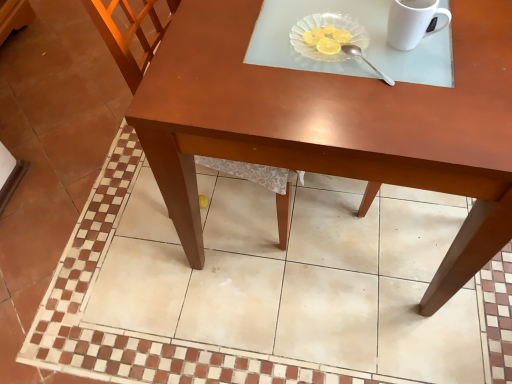
Question: Is the depth of white glossy mug at upper right greater than that of transparent glass plate at upper center?

Choices:
 (A) yes
 (B) no

Answer: (B)

Question: Is transparent glass plate at upper center located within white glossy mug at upper right?

Choices:
 (A) no
 (B) yes

Answer: (A)

Question: Does white glossy mug at upper right have a lesser height compared to transparent glass plate at upper center?

Choices:
 (A) no
 (B) yes

Answer: (A)

Question: Does white glossy mug at upper right come in front of transparent glass plate at upper center?

Choices:
 (A) no
 (B) yes

Answer: (B)

Question: Is white glossy mug at upper right thinner than transparent glass plate at upper center?

Choices:
 (A) no
 (B) yes

Answer: (B)

Question: Can you confirm if white glossy mug at upper right is wider than transparent glass plate at upper center?

Choices:
 (A) no
 (B) yes

Answer: (A)

Question: Is wooden chair at center oriented away from transparent glass plate at upper center?

Choices:
 (A) yes
 (B) no

Answer: (B)

Question: Is wooden chair at center at the left side of transparent glass plate at upper center?

Choices:
 (A) no
 (B) yes

Answer: (B)

Question: From the image's perspective, would you say wooden chair at center is shown under transparent glass plate at upper center?

Choices:
 (A) yes
 (B) no

Answer: (A)

Question: Can you confirm if wooden chair at center is taller than transparent glass plate at upper center?

Choices:
 (A) no
 (B) yes

Answer: (B)

Question: Could you tell me if wooden chair at center is turned towards transparent glass plate at upper center?

Choices:
 (A) yes
 (B) no

Answer: (A)

Question: From a real-world perspective, is wooden chair at center below transparent glass plate at upper center?

Choices:
 (A) no
 (B) yes

Answer: (B)

Question: Is the depth of transparent glass plate at upper center greater than that of white glossy mug at upper right?

Choices:
 (A) yes
 (B) no

Answer: (A)